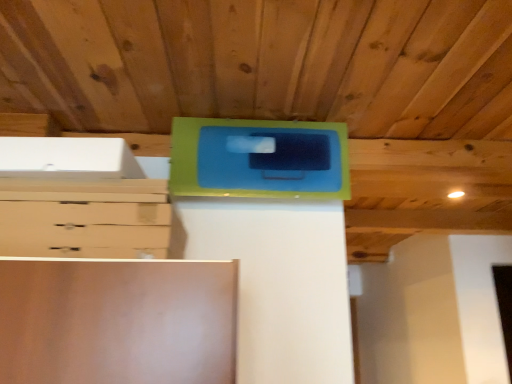
Question: In the image, is green matte cabinet at upper center on the left side or the right side of matte light brown chest of drawers at left?

Choices:
 (A) right
 (B) left

Answer: (A)

Question: Considering the positions of green matte cabinet at upper center and matte light brown chest of drawers at left in the image, is green matte cabinet at upper center bigger or smaller than matte light brown chest of drawers at left?

Choices:
 (A) big
 (B) small

Answer: (A)

Question: Considering the positions of green matte cabinet at upper center and matte light brown chest of drawers at left in the image, is green matte cabinet at upper center taller or shorter than matte light brown chest of drawers at left?

Choices:
 (A) short
 (B) tall

Answer: (B)

Question: From the image's perspective, is matte light brown chest of drawers at left located above or below green matte cabinet at upper center?

Choices:
 (A) below
 (B) above

Answer: (A)

Question: Looking at their shapes, would you say matte light brown chest of drawers at left is wider or thinner than green matte cabinet at upper center?

Choices:
 (A) wide
 (B) thin

Answer: (A)

Question: Visually, is matte light brown chest of drawers at left positioned to the left or to the right of green matte cabinet at upper center?

Choices:
 (A) right
 (B) left

Answer: (B)

Question: From their relative heights in the image, would you say matte light brown chest of drawers at left is taller or shorter than green matte cabinet at upper center?

Choices:
 (A) tall
 (B) short

Answer: (B)